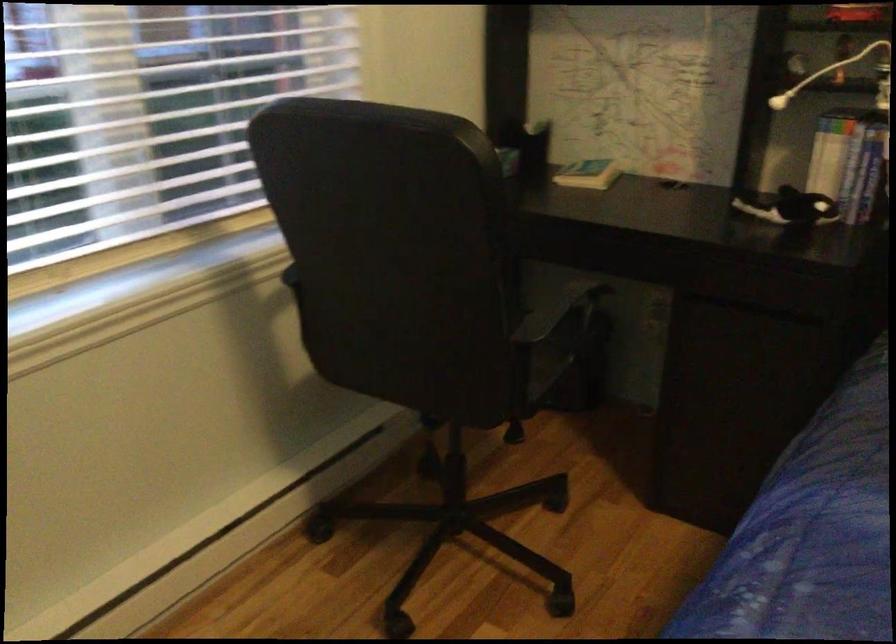
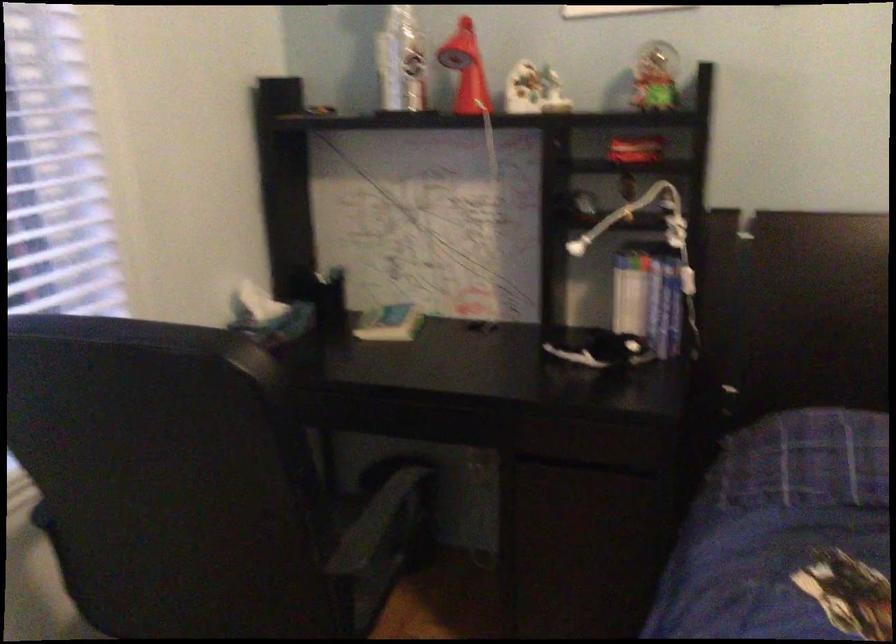
Question: The images are taken continuously from a first-person perspective. In which direction are you moving?

Choices:
 (A) Left
 (B) Right
 (C) Forward
 (D) Backward

Answer: (C)